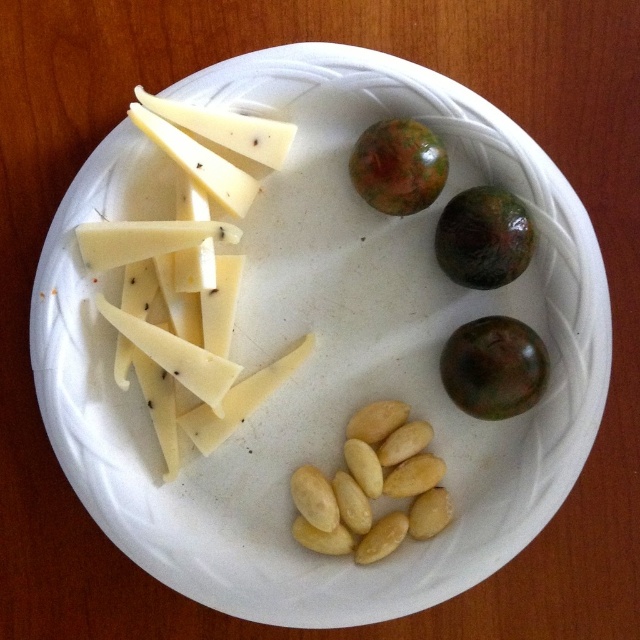
Can you confirm if yellow matte almonds at lower center is positioned below green matte passion fruit at upper right?

Yes.

How far apart are yellow matte almonds at lower center and green matte passion fruit at upper right?

yellow matte almonds at lower center and green matte passion fruit at upper right are 31.74 centimeters apart.

Is point (312, 525) positioned before point (458, 234)?

No.

Locate an element on the screen. The height and width of the screenshot is (640, 640). yellow matte almonds at lower center is located at coordinates (372, 486).

Is point (160, 112) closer to camera compared to point (465, 193)?

Yes, it is.

Can you confirm if yellow cheese at upper left is positioned to the left of green matte passion fruit at upper right?

Indeed, yellow cheese at upper left is positioned on the left side of green matte passion fruit at upper right.

The image size is (640, 640). I want to click on yellow cheese at upper left, so click(x=188, y=276).

At what (x,y) coordinates should I click in order to perform the action: click on yellow cheese at upper left. Please return your answer as a coordinate pair (x, y). Looking at the image, I should click on (188, 276).

Is point (131, 257) positioned after point (316, 483)?

No, it is in front of (316, 483).

The width and height of the screenshot is (640, 640). I want to click on yellow cheese at upper left, so click(188, 276).